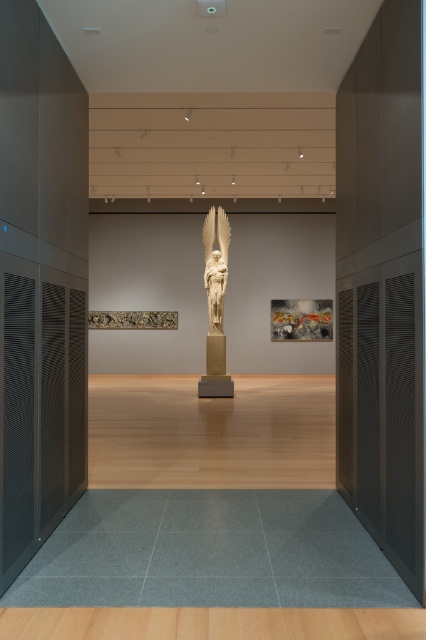
From the picture: Does white marble statue at center appear under gold textured sculpture at center?

Incorrect, white marble statue at center is not positioned below gold textured sculpture at center.

Can you confirm if white marble statue at center is positioned above gold textured sculpture at center?

Correct, white marble statue at center is located above gold textured sculpture at center.

Is point (212, 253) closer to viewer compared to point (327, 321)?

Yes, point (212, 253) is closer to viewer.

Locate an element on the screen. The height and width of the screenshot is (640, 426). white marble statue at center is located at coordinates (215, 305).